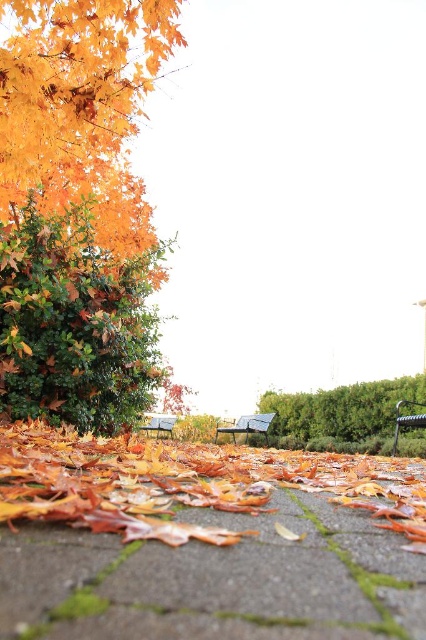
You are standing at the center of the paved area covered with fallen leaves. You want to walk towards the green leafy hedge at lower right. Which direction should you head?

The green leafy hedge at lower right is located at point 0.648 on the x axis and 0.800 on the y axis. Since you are at the center, you should move towards the lower right direction to reach the green leafy hedge at lower right.

You are a gardener assessing the autumn foliage. You notice the golden textured leaves at left and the orange leaf litter at lower center. Which of these two has a smaller width?

The golden textured leaves at left has a smaller width than the orange leaf litter at lower center.

You are standing in the autumn scene described. There is a point marked at coordinates (340, 413). What object is located at this point?

The point at coordinates (340, 413) corresponds to the green leafy hedge at lower right.